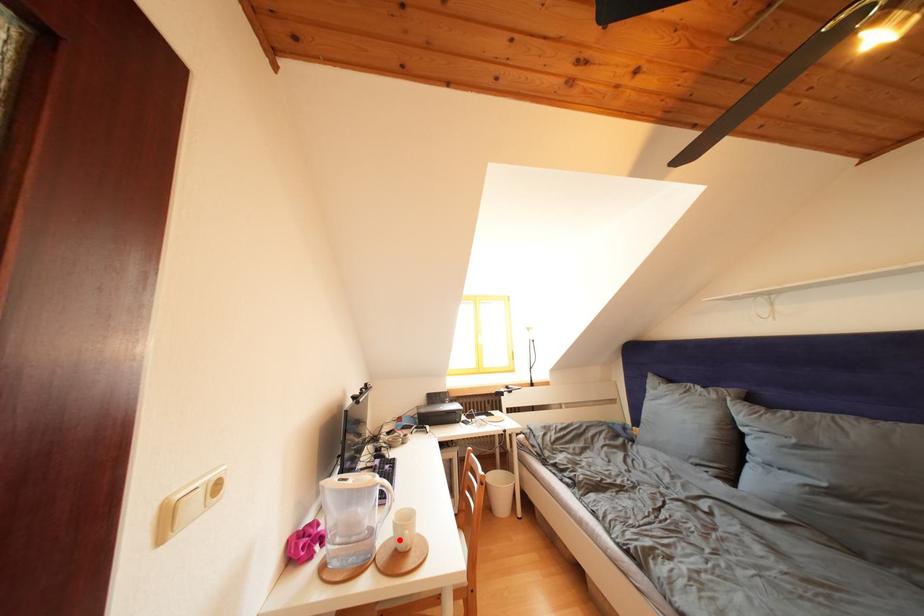
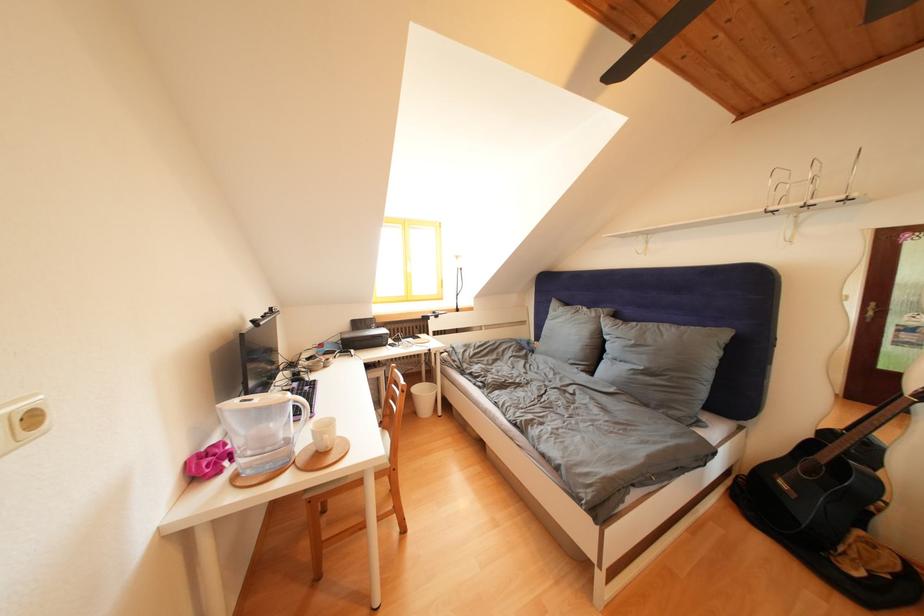
Find the pixel in the second image that matches the highlighted location in the first image.

(320, 446)